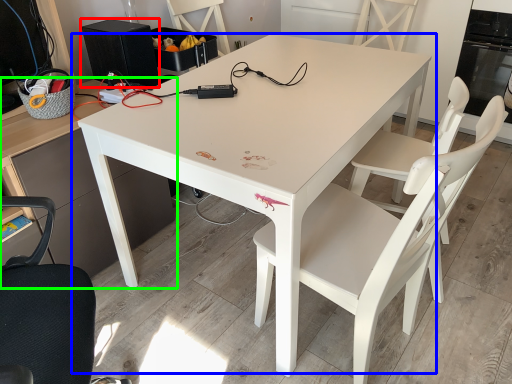
Question: Estimate the real-world distances between objects in this image. Which object is farther from appliance (highlighted by a red box), table (highlighted by a blue box) or desk (highlighted by a green box)?

Choices:
 (A) table
 (B) desk

Answer: (A)